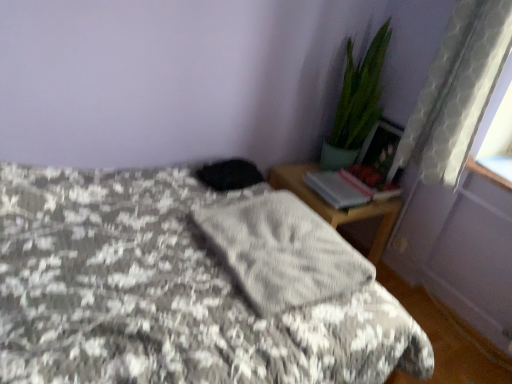
Question: Is gray textured blanket at center oriented towards white sheer curtain at right?

Choices:
 (A) no
 (B) yes

Answer: (A)

Question: Can you confirm if gray textured blanket at center is shorter than white sheer curtain at right?

Choices:
 (A) no
 (B) yes

Answer: (A)

Question: From a real-world perspective, is gray textured blanket at center positioned under white sheer curtain at right based on gravity?

Choices:
 (A) no
 (B) yes

Answer: (B)

Question: Can you confirm if gray textured blanket at center is taller than white sheer curtain at right?

Choices:
 (A) no
 (B) yes

Answer: (B)

Question: Is gray textured blanket at center positioned far away from white sheer curtain at right?

Choices:
 (A) no
 (B) yes

Answer: (B)

Question: Considering the positions of green glossy plant at upper right and wooden nightstand at right in the image, is green glossy plant at upper right taller or shorter than wooden nightstand at right?

Choices:
 (A) short
 (B) tall

Answer: (B)

Question: From a real-world perspective, is green glossy plant at upper right above or below wooden nightstand at right?

Choices:
 (A) below
 (B) above

Answer: (B)

Question: Considering the positions of green glossy plant at upper right and wooden nightstand at right in the image, is green glossy plant at upper right bigger or smaller than wooden nightstand at right?

Choices:
 (A) small
 (B) big

Answer: (A)

Question: Considering the relative positions of green glossy plant at upper right and wooden nightstand at right in the image provided, is green glossy plant at upper right to the left or to the right of wooden nightstand at right?

Choices:
 (A) left
 (B) right

Answer: (B)

Question: Considering the positions of clear glass window sill at upper right and white sheer curtain at right in the image, is clear glass window sill at upper right bigger or smaller than white sheer curtain at right?

Choices:
 (A) small
 (B) big

Answer: (A)

Question: From a real-world perspective, is clear glass window sill at upper right above or below white sheer curtain at right?

Choices:
 (A) below
 (B) above

Answer: (A)

Question: In the image, is clear glass window sill at upper right positioned in front of or behind white sheer curtain at right?

Choices:
 (A) front
 (B) behind

Answer: (B)

Question: Would you say clear glass window sill at upper right is inside or outside white sheer curtain at right?

Choices:
 (A) inside
 (B) outside

Answer: (B)

Question: Considering the positions of point (396, 210) and point (506, 183), is point (396, 210) closer or farther from the camera than point (506, 183)?

Choices:
 (A) closer
 (B) farther

Answer: (B)

Question: Do you think wooden nightstand at right is within clear glass window sill at upper right, or outside of it?

Choices:
 (A) outside
 (B) inside

Answer: (A)